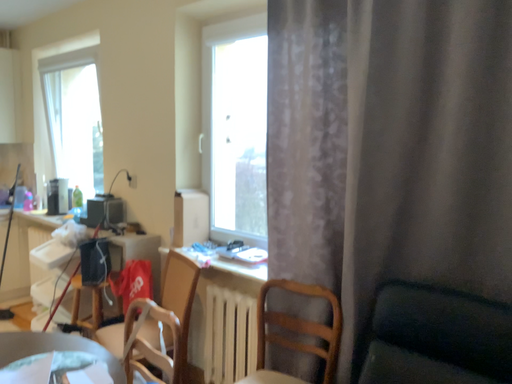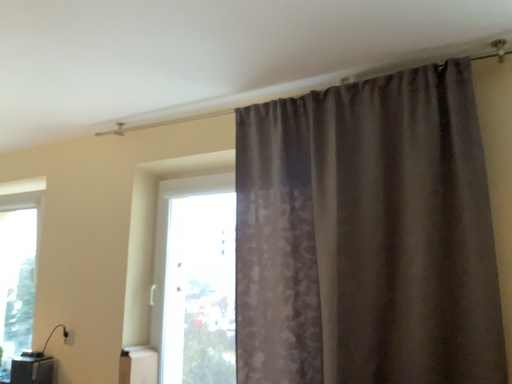
Question: Which way did the camera rotate in the video?

Choices:
 (A) rotated right
 (B) rotated left

Answer: (A)